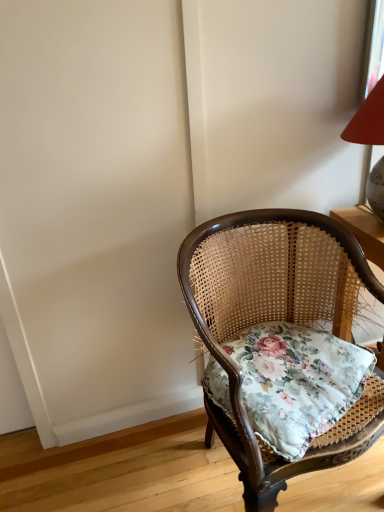
Question: Should I look upward or downward to see floral fabric cushion at center?

Choices:
 (A) up
 (B) down

Answer: (B)

Question: Is floral fabric cushion at center thinner than woven wood chair at center?

Choices:
 (A) yes
 (B) no

Answer: (A)

Question: Is floral fabric cushion at center positioned far away from woven wood chair at center?

Choices:
 (A) yes
 (B) no

Answer: (B)

Question: Does floral fabric cushion at center have a lesser height compared to woven wood chair at center?

Choices:
 (A) no
 (B) yes

Answer: (B)

Question: Considering the relative sizes of floral fabric cushion at center and woven wood chair at center in the image provided, is floral fabric cushion at center smaller than woven wood chair at center?

Choices:
 (A) yes
 (B) no

Answer: (A)

Question: Can you see floral fabric cushion at center touching woven wood chair at center?

Choices:
 (A) no
 (B) yes

Answer: (A)

Question: Is floral fabric cushion at center positioned before woven wood chair at center?

Choices:
 (A) yes
 (B) no

Answer: (B)

Question: Considering the relative sizes of woven wood chair at center and floral fabric cushion at center in the image provided, is woven wood chair at center taller than floral fabric cushion at center?

Choices:
 (A) yes
 (B) no

Answer: (A)

Question: Does woven wood chair at center appear on the left side of floral fabric cushion at center?

Choices:
 (A) yes
 (B) no

Answer: (A)

Question: From the image's perspective, is woven wood chair at center over floral fabric cushion at center?

Choices:
 (A) no
 (B) yes

Answer: (A)

Question: Is woven wood chair at center positioned behind floral fabric cushion at center?

Choices:
 (A) yes
 (B) no

Answer: (B)

Question: Does woven wood chair at center come in front of floral fabric cushion at center?

Choices:
 (A) yes
 (B) no

Answer: (A)

Question: Is woven wood chair at center bigger than floral fabric cushion at center?

Choices:
 (A) yes
 (B) no

Answer: (A)

Question: Considering the positions of point (334, 353) and point (218, 272), is point (334, 353) closer or farther from the camera than point (218, 272)?

Choices:
 (A) farther
 (B) closer

Answer: (B)